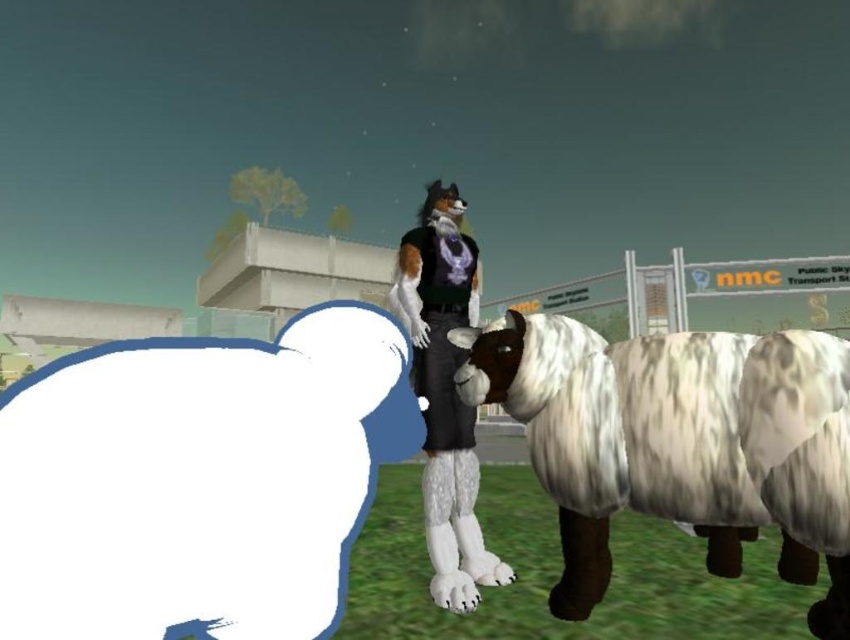
Question: Which object is farther from the camera taking this photo?

Choices:
 (A) white fur sheep at left
 (B) fuzzy fur outfit at center
 (C) white woolen sheep at right

Answer: (B)

Question: Can you confirm if white fur sheep at left is positioned below fuzzy fur outfit at center?

Choices:
 (A) yes
 (B) no

Answer: (A)

Question: Which point appears farthest from the camera in this image?

Choices:
 (A) (428, 243)
 (B) (173, 508)
 (C) (790, 394)

Answer: (A)

Question: Is white fur sheep at left further to the viewer compared to white woolen sheep at right?

Choices:
 (A) yes
 (B) no

Answer: (B)

Question: Which object appears closest to the camera in this image?

Choices:
 (A) fuzzy fur outfit at center
 (B) white fur sheep at left

Answer: (B)

Question: Is white fur sheep at left above fuzzy fur outfit at center?

Choices:
 (A) no
 (B) yes

Answer: (A)